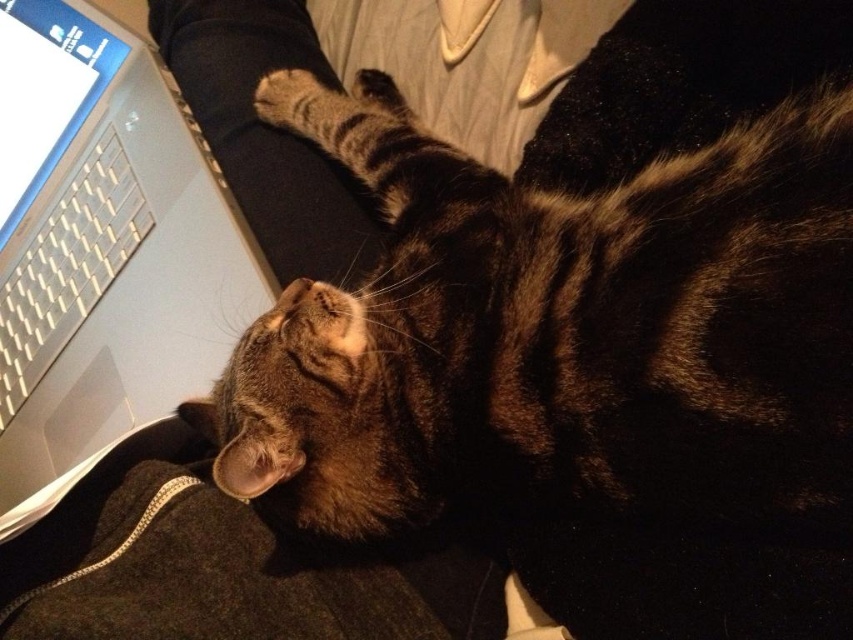
Question: Where is brown striped fur cat at center located in relation to white plastic keyboard at left in the image?

Choices:
 (A) left
 (B) right

Answer: (B)

Question: Which of the following is the farthest from the observer?

Choices:
 (A) (602, 205)
 (B) (140, 134)
 (C) (21, 272)

Answer: (C)

Question: Does sleek silver laptop at left have a smaller size compared to white plastic keyboard at left?

Choices:
 (A) no
 (B) yes

Answer: (A)

Question: Estimate the real-world distances between objects in this image. Which object is farther from the brown striped fur cat at center?

Choices:
 (A) white plastic keyboard at left
 (B) sleek silver laptop at left

Answer: (A)

Question: Which point appears closest to the camera in this image?

Choices:
 (A) (840, 161)
 (B) (13, 304)
 (C) (206, 360)

Answer: (A)

Question: Does brown striped fur cat at center have a smaller size compared to sleek silver laptop at left?

Choices:
 (A) yes
 (B) no

Answer: (B)